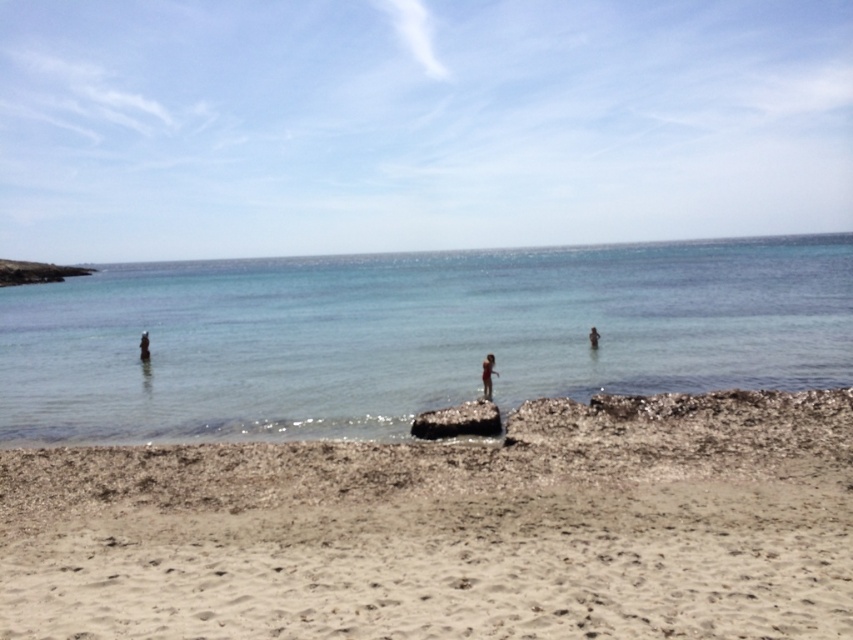
Is pink fabric person at center above smooth skin person at left?

No, pink fabric person at center is not above smooth skin person at left.

Who is shorter, pink fabric person at center or smooth skin person at left?

smooth skin person at left is shorter.

Is point (489, 371) in front of point (146, 355)?

Yes.

Where is `pink fabric person at center`? pink fabric person at center is located at coordinates (x=486, y=376).

Can you confirm if black shiny rock at center is shorter than pink fabric person at center?

Indeed, black shiny rock at center has a lesser height compared to pink fabric person at center.

Measure the distance between point (453, 420) and camera.

They are 13.58 meters apart.

The image size is (853, 640). I want to click on black shiny rock at center, so click(457, 420).

Which is above, clear blue water at center or smooth skin person at left?

clear blue water at center

Who is more distant from viewer, (589, 300) or (140, 340)?

Point (589, 300)

Which is in front, point (216, 362) or point (144, 342)?

Point (216, 362) is more forward.

You are a GUI agent. You are given a task and a screenshot of the screen. Output one action in this format:
    pyautogui.click(x=<x>, y=<y>)
    Task: Click on the clear blue water at center
    The width and height of the screenshot is (853, 640).
    Given the screenshot: What is the action you would take?
    pyautogui.click(x=412, y=336)